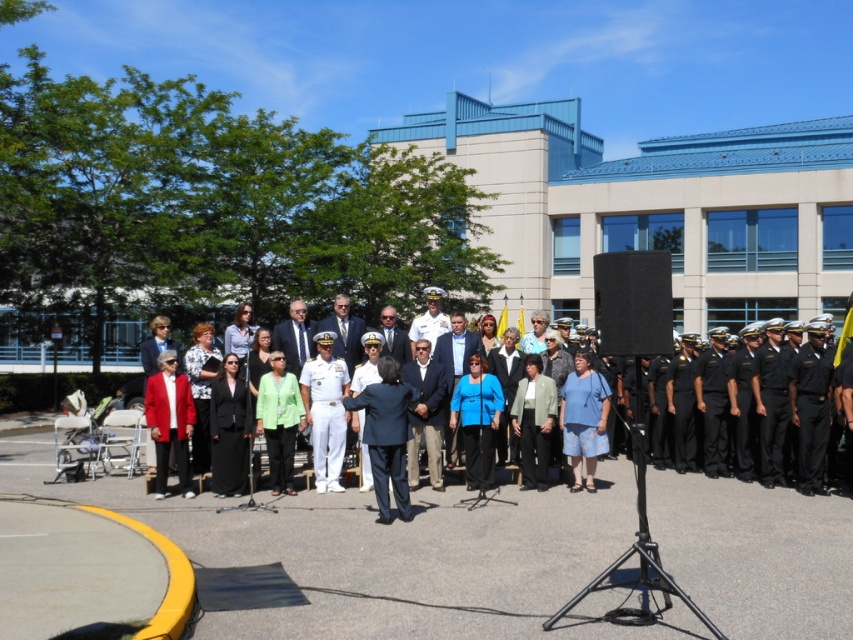
Is dark blue suit at center closer to the viewer compared to green matte jacket at center?

Yes, dark blue suit at center is closer to the viewer.

Who is shorter, dark blue suit at center or green matte jacket at center?

With less height is dark blue suit at center.

The image size is (853, 640). Describe the element at coordinates (387, 435) in the screenshot. I see `dark blue suit at center` at that location.

I want to click on dark blue suit at center, so click(387, 435).

Measure the distance between point (705,376) and camera.

Point (705,376) and camera are 41.37 feet apart from each other.

Is matte black suit at center positioned in front of dark blue suit at center?

That is True.

Is point (788, 333) farther from camera compared to point (402, 403)?

Yes, it is behind point (402, 403).

You are a GUI agent. You are given a task and a screenshot of the screen. Output one action in this format:
    pyautogui.click(x=<x>, y=<y>)
    Task: Click on the matte black suit at center
    Image resolution: width=853 pixels, height=640 pixels.
    Given the screenshot: What is the action you would take?
    pyautogui.click(x=802, y=387)

Is dark blue suit at center to the left of matte red blazer at left from the viewer's perspective?

In fact, dark blue suit at center is to the right of matte red blazer at left.

Between dark blue suit at center and matte red blazer at left, which one has less height?

Standing shorter between the two is dark blue suit at center.

Does point (387, 508) come closer to viewer compared to point (163, 481)?

That is True.

This screenshot has width=853, height=640. I want to click on dark blue suit at center, so click(387, 435).